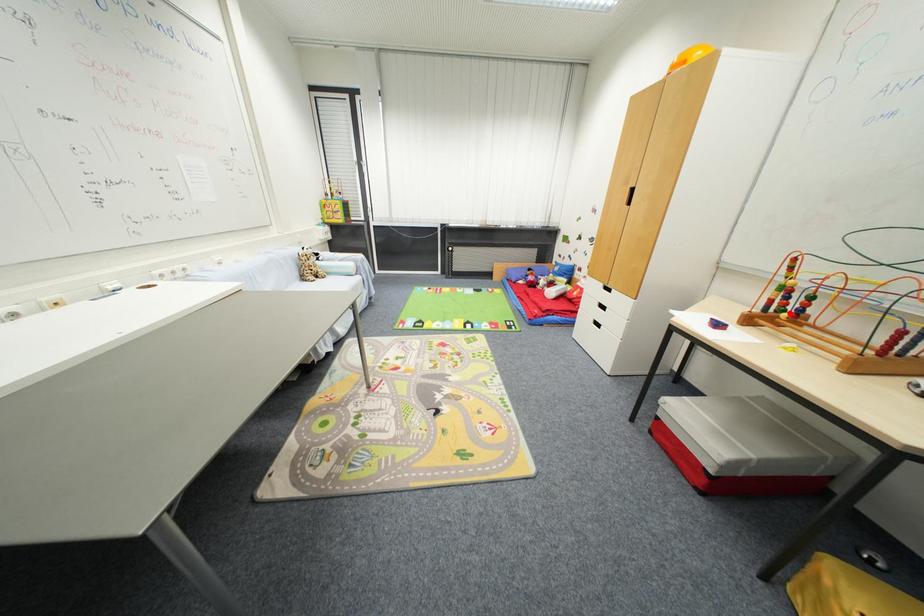
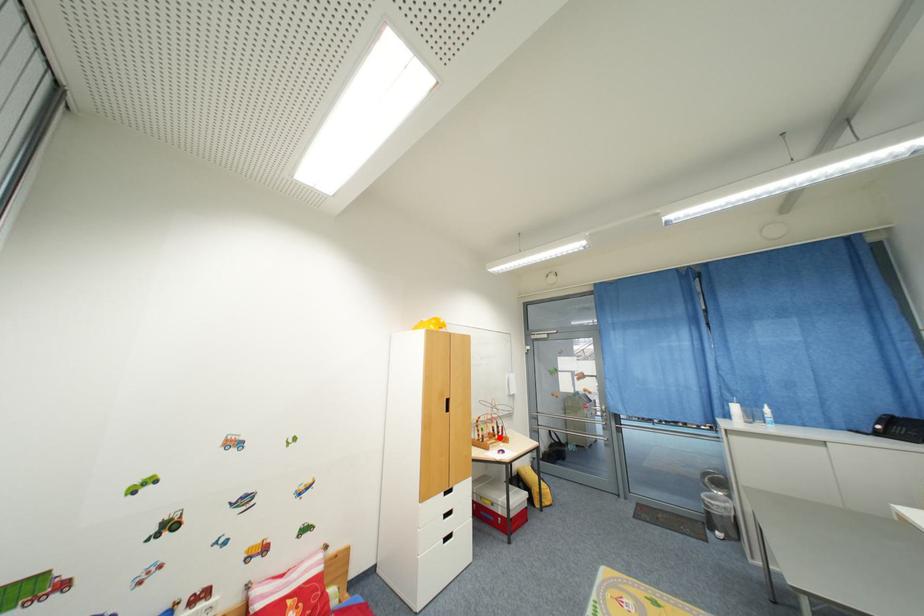
I am providing you with two images of the same scene from different viewpoints. A red point is marked on the first image and another point is marked on the second image. Does the point marked in image1 correspond to the same location as the one in image2?

Yes